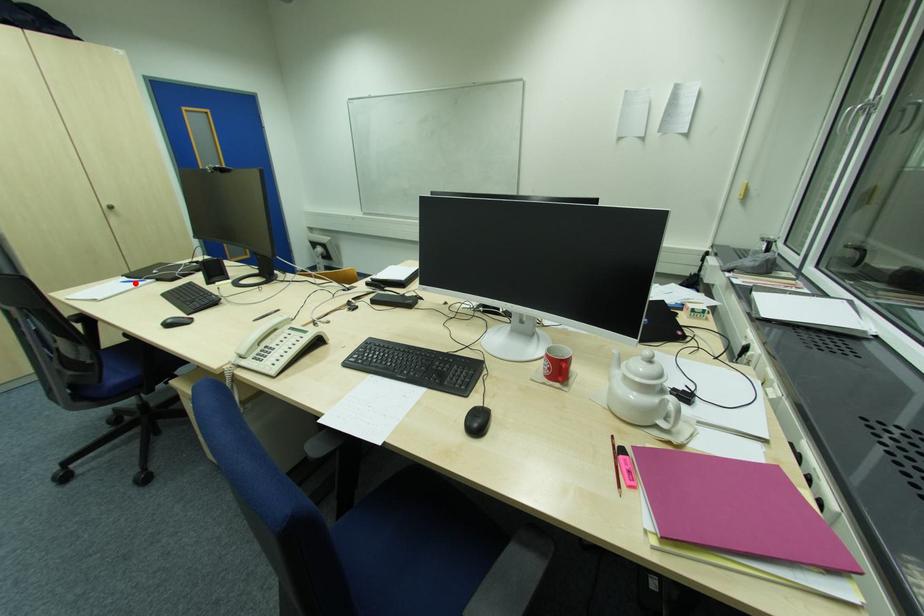
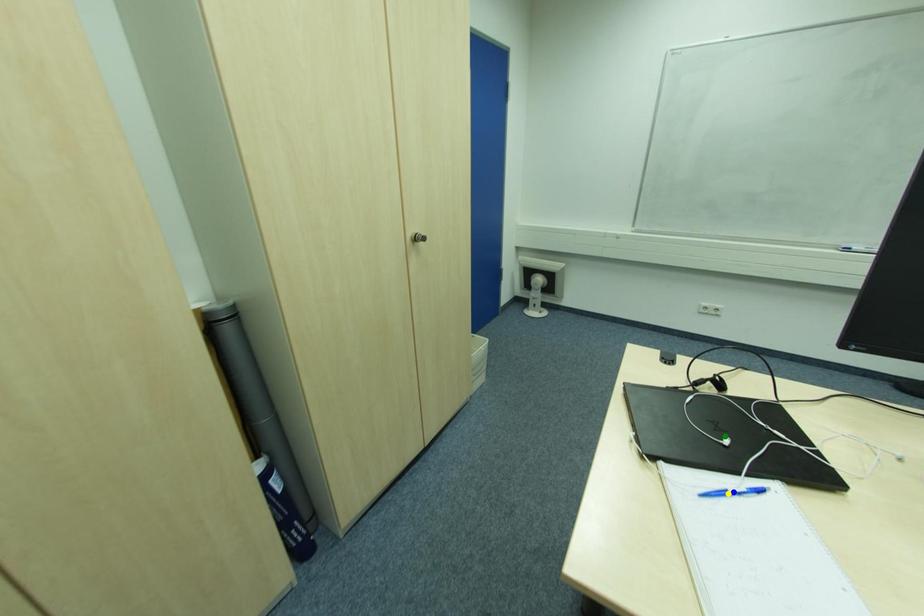
Question: I am providing you with two images of the same scene from different viewpoints. A red point is marked on the first image. You are given multiple points on the second image. Which spot in image 2 lines up with the point in image 1?

Choices:
 (A) blue point
 (B) yellow point
 (C) green point

Answer: (B)